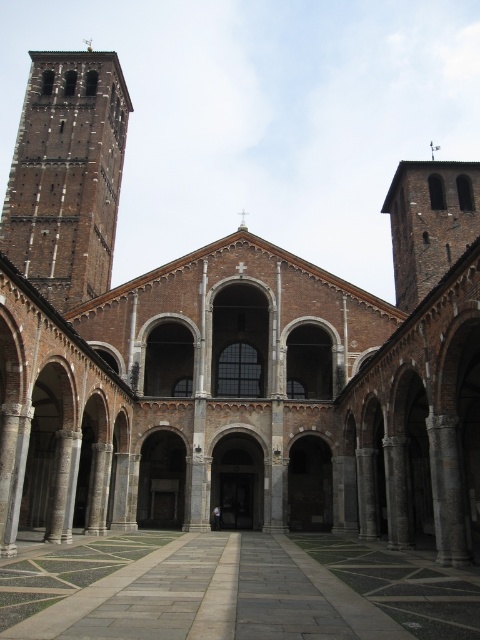
Question: Where is smooth stone floor at center located in relation to brick tower at upper left in the image?

Choices:
 (A) right
 (B) left

Answer: (A)

Question: Does smooth stone floor at center appear over brick tower at upper left?

Choices:
 (A) no
 (B) yes

Answer: (A)

Question: Which point is farther from the camera taking this photo?

Choices:
 (A) (414, 614)
 (B) (123, 100)

Answer: (B)

Question: Which point is farther to the camera?

Choices:
 (A) smooth stone floor at center
 (B) brick tower at upper left

Answer: (B)

Question: Is smooth stone floor at center closer to the viewer compared to brick tower at upper left?

Choices:
 (A) no
 (B) yes

Answer: (B)

Question: Which point is farther from the camera taking this photo?

Choices:
 (A) (24, 236)
 (B) (358, 604)

Answer: (A)